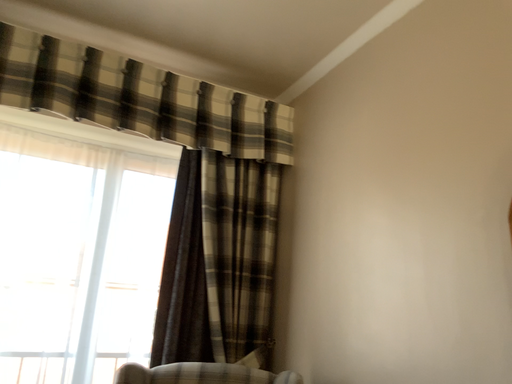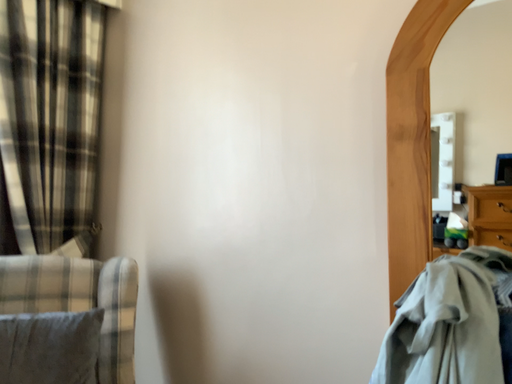
Question: How did the camera likely rotate when shooting the video?

Choices:
 (A) rotated downward
 (B) rotated upward

Answer: (A)